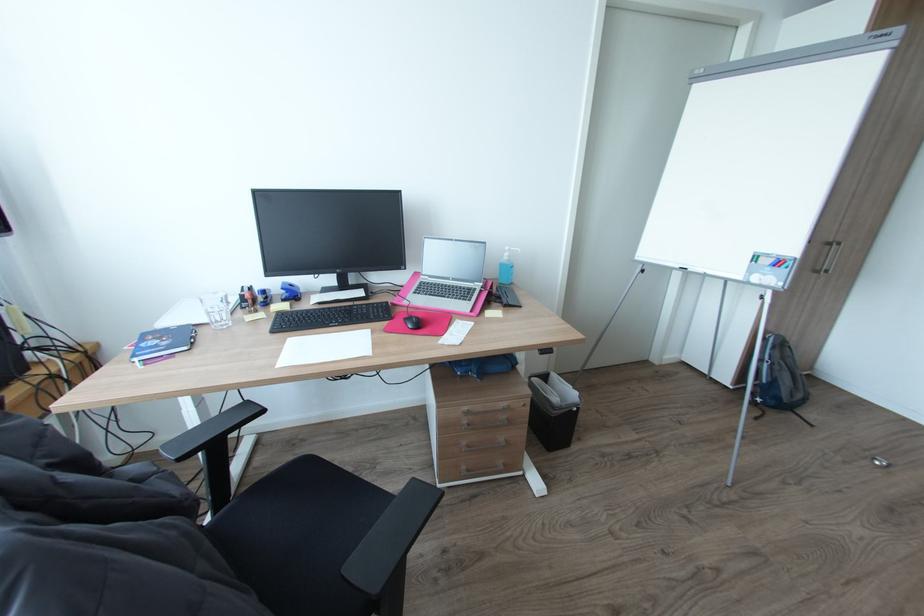
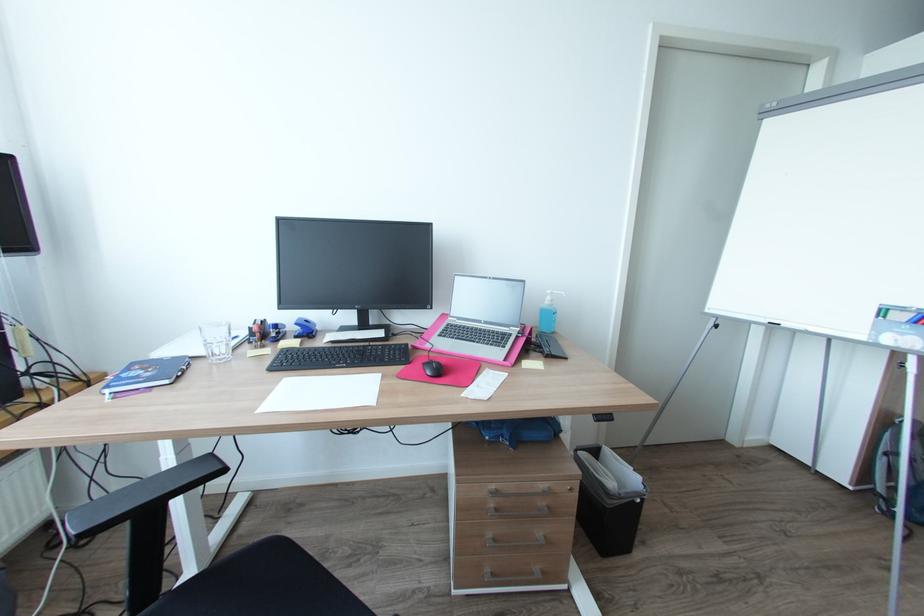
Locate, in the second image, the point that corresponds to (x=225, y=321) in the first image.

(225, 354)